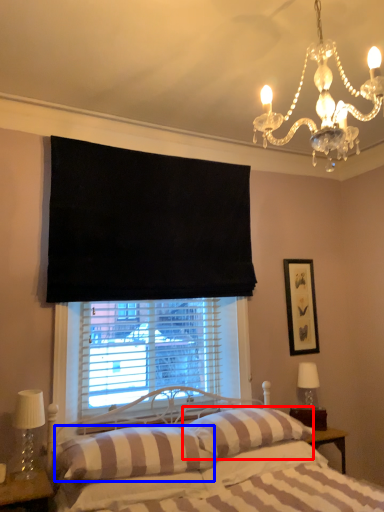
Question: Which object is further to the camera taking this photo, pillow (highlighted by a red box) or pillow (highlighted by a blue box)?

Choices:
 (A) pillow
 (B) pillow

Answer: (A)